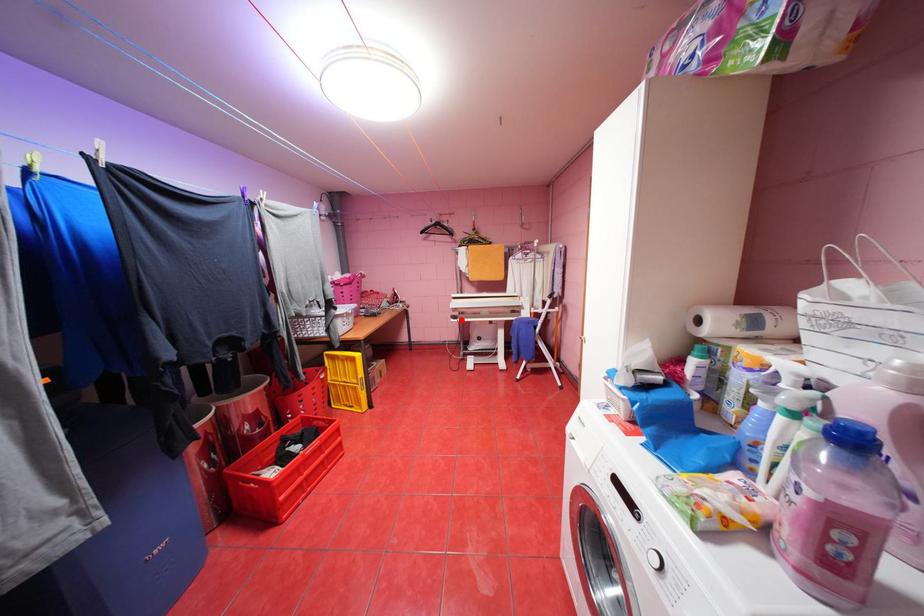
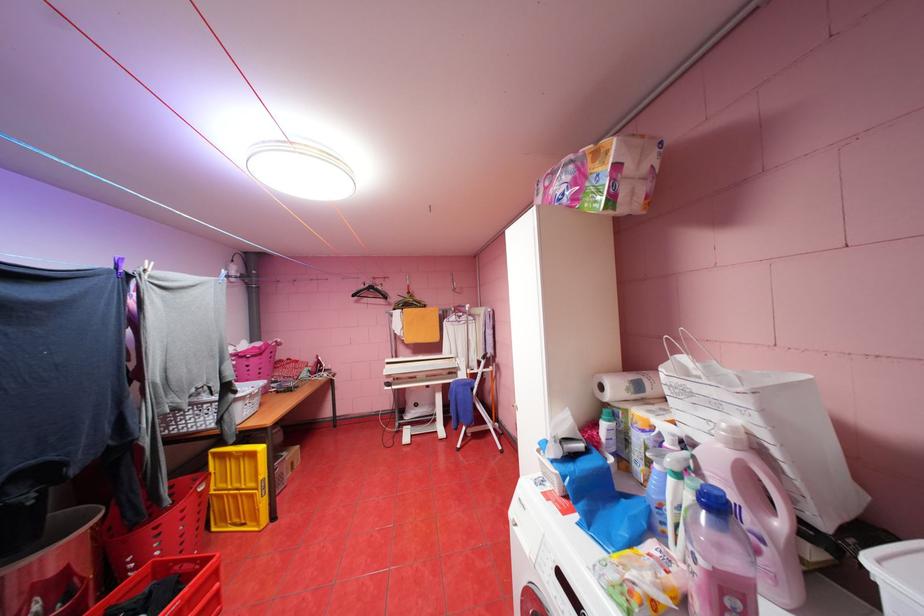
Question: I am providing you with two images of the same scene from different viewpoints. In image1, a red point is highlighted. Considering the same 3D point in image2, which of the following is correct?

Choices:
 (A) It is closer
 (B) It is farther

Answer: (B)